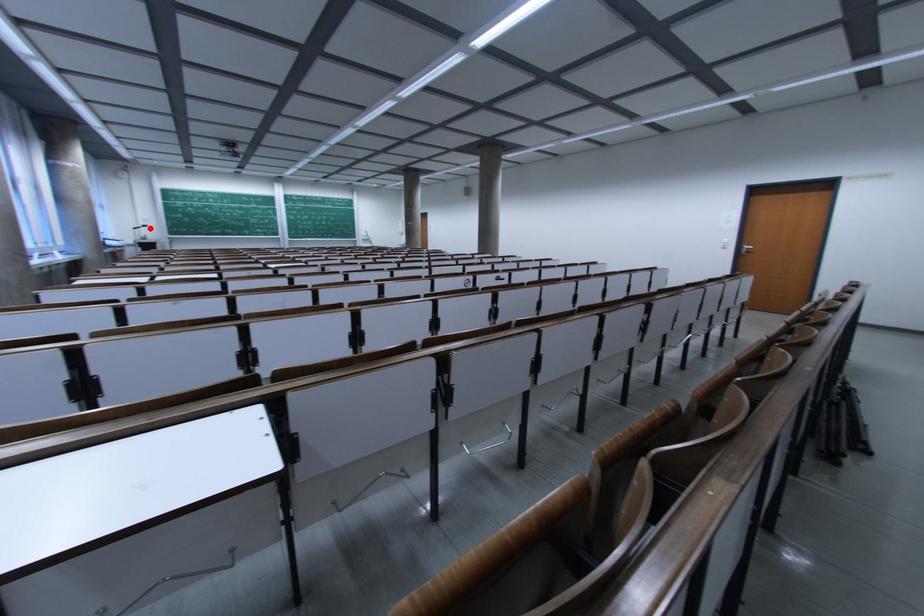
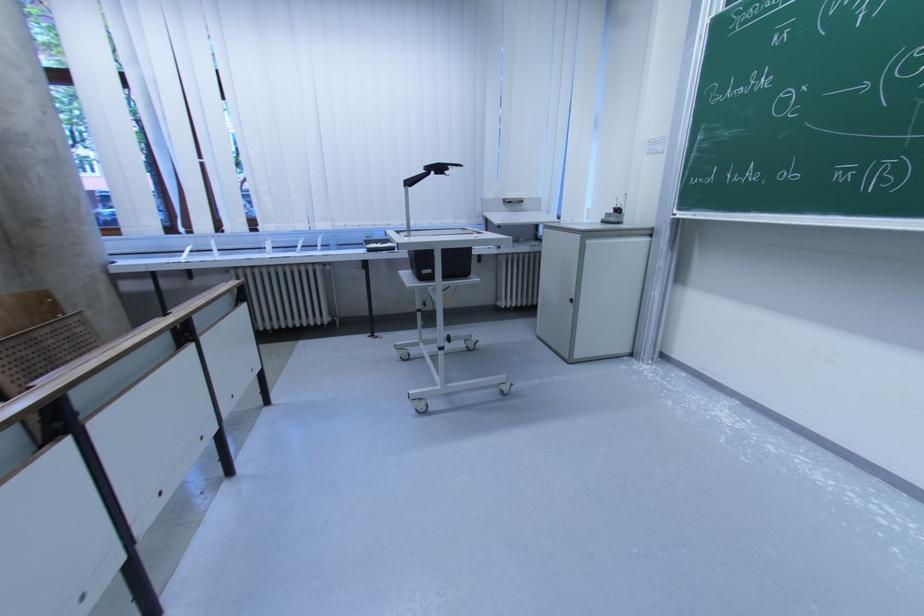
Where in the second image is the point corresponding to the highlighted location from the first image?

(444, 171)